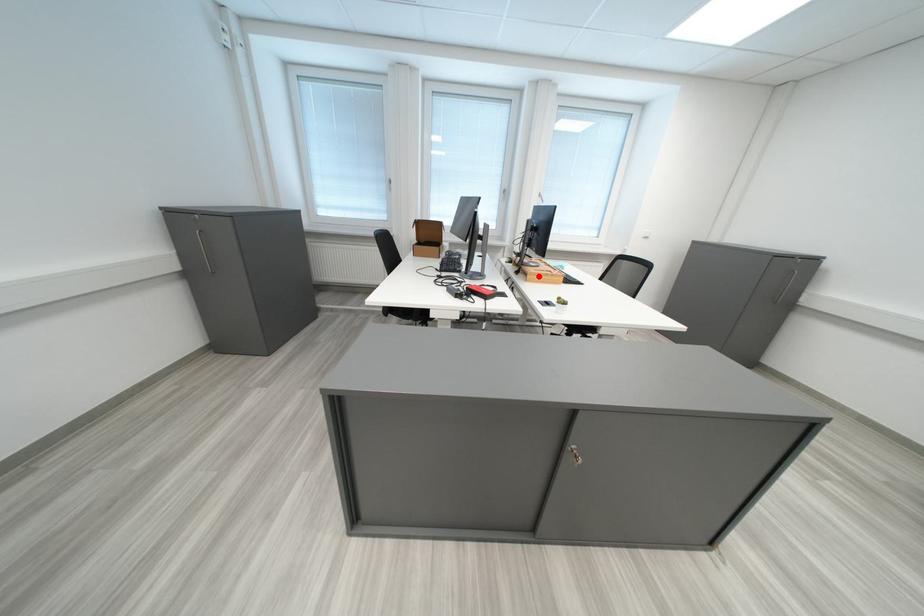
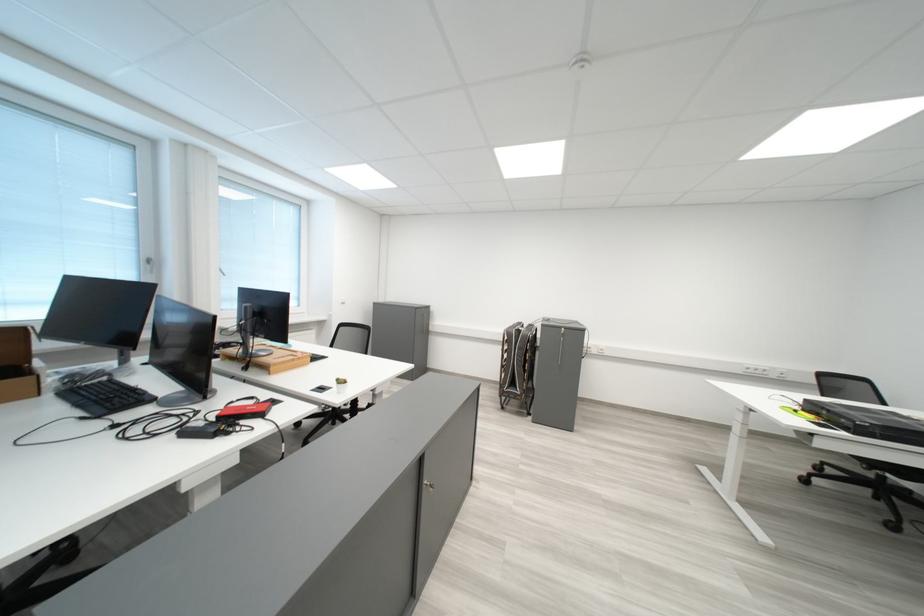
Where in the second image is the point corresponding to the highlighted location from the first image?

(277, 369)